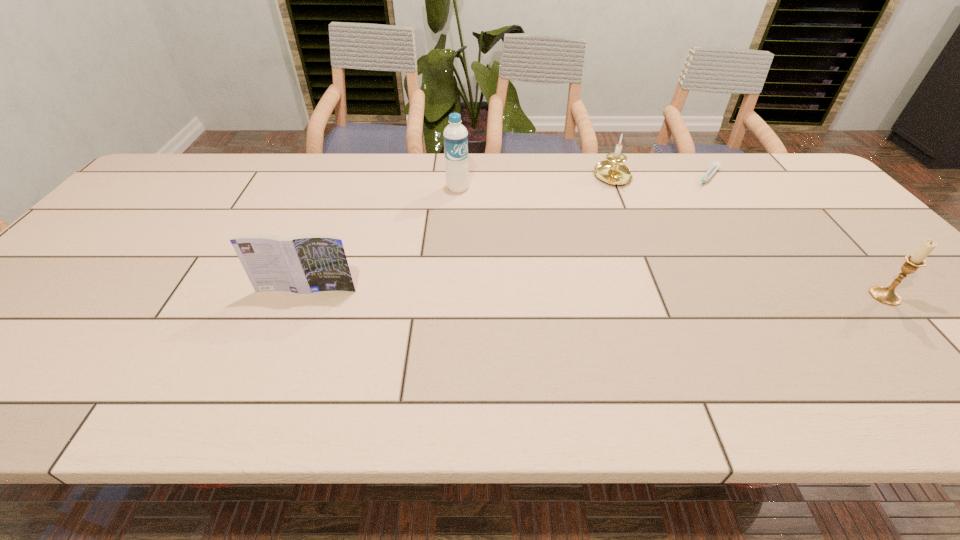
Locate an element on the screen. The width and height of the screenshot is (960, 540). book is located at coordinates (307, 263).

Locate an element on the screen. The width and height of the screenshot is (960, 540). the rightmost object is located at coordinates (886, 295).

Locate an element on the screen. Image resolution: width=960 pixels, height=540 pixels. the right candle holder is located at coordinates (886, 295).

Find the location of a particular element. the fourth object from right to left is located at coordinates (455, 136).

Where is `water bottle`? water bottle is located at coordinates (455, 136).

The width and height of the screenshot is (960, 540). Find the location of `the fourth object from left to right`. the fourth object from left to right is located at coordinates point(715,166).

In order to click on syringe in this screenshot , I will do `click(715, 166)`.

Locate an element on the screen. The height and width of the screenshot is (540, 960). the shorter candle holder is located at coordinates (612, 171).

Locate an element on the screen. The height and width of the screenshot is (540, 960). the farther candle holder is located at coordinates (612, 171).

In order to click on vacant space positioned 0.130m on the front cover of the leftmost object in this screenshot , I will do `click(287, 338)`.